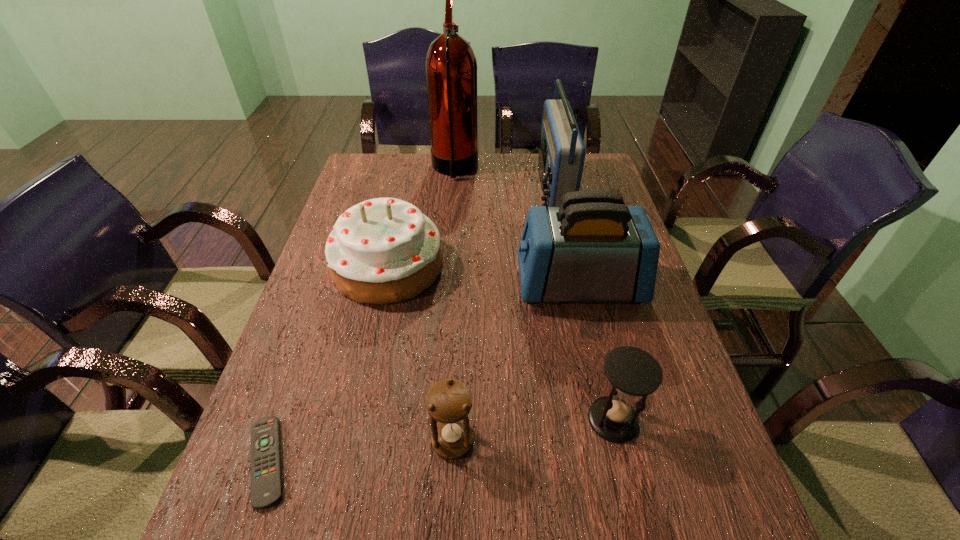
Locate an element on the screen. fire extinguisher is located at coordinates (450, 66).

Identify the location of radio receiver. Image resolution: width=960 pixels, height=540 pixels. (561, 157).

Find the location of a particular element. toaster is located at coordinates (593, 248).

Identify the location of cake. Image resolution: width=960 pixels, height=540 pixels. (383, 250).

You are a GUI agent. You are given a task and a screenshot of the screen. Output one action in this format:
    pyautogui.click(x=<x>, y=<y>)
    Task: Click on the right hourglass
    The width and height of the screenshot is (960, 540).
    Given the screenshot: What is the action you would take?
    pyautogui.click(x=632, y=371)

At what (x,y) coordinates should I click in order to perform the action: click on the left hourglass. Please return your answer as a coordinate pair (x, y). This screenshot has height=540, width=960. Looking at the image, I should click on (449, 401).

The height and width of the screenshot is (540, 960). Identify the location of remote control. (266, 476).

The height and width of the screenshot is (540, 960). In order to click on free spot located on the front-facing side of the fire extinguisher in this screenshot , I will do pos(566,169).

Find the location of `vacant area situated on the front panel of the radio receiver`. vacant area situated on the front panel of the radio receiver is located at coordinates (481, 191).

I want to click on vacant space located 0.310m on the front panel of the radio receiver, so click(445, 191).